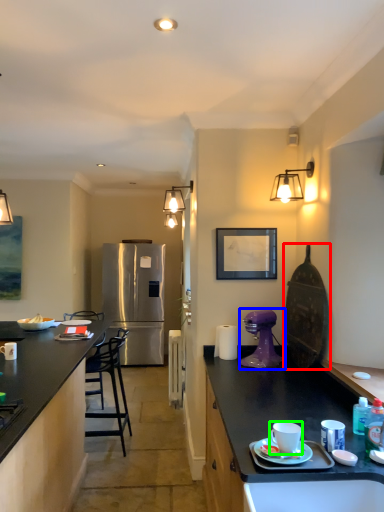
Question: Which object is positioned farthest from appliance (highlighted by a red box)? Select from coffee maker (highlighted by a blue box) and coffee cup (highlighted by a green box).

Choices:
 (A) coffee maker
 (B) coffee cup

Answer: (B)